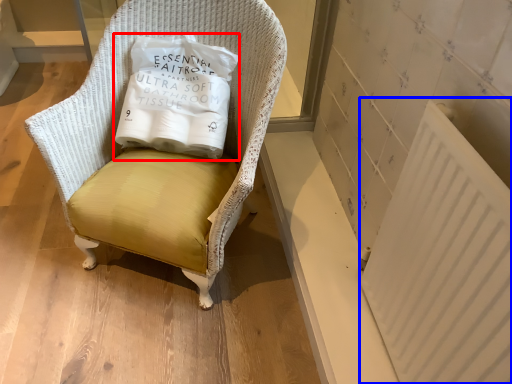
Question: Which of the following is the closest to the observer, pillow (highlighted by a red box) or radiator (highlighted by a blue box)?

Choices:
 (A) pillow
 (B) radiator

Answer: (B)